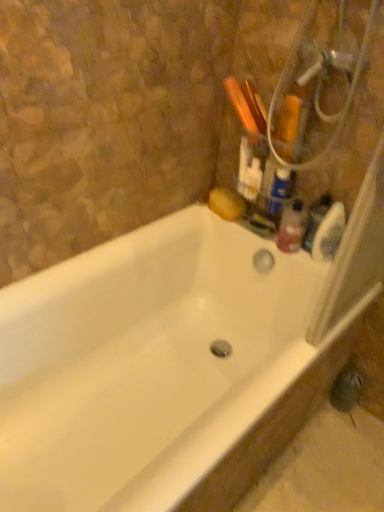
Where is `white glossy bathtub at upper right`? The height and width of the screenshot is (512, 384). white glossy bathtub at upper right is located at coordinates (147, 362).

What is the approximate height of translucent plastic bottle at upper right, marked as the second cleaning product in a bottom-to-top arrangement?

6.94 inches.

What are the coordinates of `metallic silver showerhead at upper right` in the screenshot? It's located at (346, 99).

Locate an element on the screen. white glossy bathtub at upper right is located at coordinates (147, 362).

From a real-world perspective, is translucent plastic soap dispenser at upper right beneath translucent plastic bottle at upper right, which ranks as the 1th cleaning product in top-to-bottom order?

Yes, from a real-world perspective, translucent plastic soap dispenser at upper right is below translucent plastic bottle at upper right, which ranks as the 1th cleaning product in top-to-bottom order.

Considering the relative positions of translucent plastic soap dispenser at upper right and translucent plastic bottle at upper right, marked as the second cleaning product in a bottom-to-top arrangement, in the image provided, is translucent plastic soap dispenser at upper right to the left of translucent plastic bottle at upper right, marked as the second cleaning product in a bottom-to-top arrangement, from the viewer's perspective?

Incorrect, translucent plastic soap dispenser at upper right is not on the left side of translucent plastic bottle at upper right, marked as the second cleaning product in a bottom-to-top arrangement.

Does translucent plastic soap dispenser at upper right come in front of translucent plastic bottle at upper right, marked as the second cleaning product in a bottom-to-top arrangement?

No.

In the image, there is a translucent plastic bottle at upper right, placed as the 1th cleaning product when sorted from bottom to top. In order to click on bathtub below it (from a real-world perspective) in this screenshot , I will do `click(147, 362)`.

Which object is thinner, translucent plastic bottle at upper right, placed as the 1th cleaning product when sorted from bottom to top, or white glossy bathtub at upper right?

translucent plastic bottle at upper right, placed as the 1th cleaning product when sorted from bottom to top, is thinner.

From their relative heights in the image, would you say translucent plastic bottle at upper right, the second cleaning product in the top-to-bottom sequence, is taller or shorter than white glossy bathtub at upper right?

In the image, translucent plastic bottle at upper right, the second cleaning product in the top-to-bottom sequence, appears to be shorter than white glossy bathtub at upper right.

Is translucent plastic bottle at upper right, the second cleaning product in the top-to-bottom sequence, looking in the opposite direction of white glossy bathtub at upper right?

No, white glossy bathtub at upper right is not at the back of translucent plastic bottle at upper right, the second cleaning product in the top-to-bottom sequence.

Does white glossy bathtub at upper right lie in front of translucent plastic soap dispenser at upper right?

That is True.

Are white glossy bathtub at upper right and translucent plastic soap dispenser at upper right located far from each other?

white glossy bathtub at upper right is actually quite close to translucent plastic soap dispenser at upper right.

Which of these two, white glossy bathtub at upper right or translucent plastic soap dispenser at upper right, is thinner?

translucent plastic soap dispenser at upper right.

Is point (62, 421) closer or farther from the camera than point (324, 211)?

Point (62, 421).

Is there a large distance between translucent plastic soap dispenser at upper right and translucent plastic bottle at upper right, placed as the 1th cleaning product when sorted from bottom to top?

translucent plastic soap dispenser at upper right is near translucent plastic bottle at upper right, placed as the 1th cleaning product when sorted from bottom to top, not far away.

Is translucent plastic soap dispenser at upper right in front of translucent plastic bottle at upper right, placed as the 1th cleaning product when sorted from bottom to top?

Yes, the depth of translucent plastic soap dispenser at upper right is less than that of translucent plastic bottle at upper right, placed as the 1th cleaning product when sorted from bottom to top.

Based on their positions, is translucent plastic soap dispenser at upper right located to the left or right of translucent plastic bottle at upper right, placed as the 1th cleaning product when sorted from bottom to top?

Based on their positions, translucent plastic soap dispenser at upper right is located to the right of translucent plastic bottle at upper right, placed as the 1th cleaning product when sorted from bottom to top.

Find the location of a particular element. the 1st cleaning product counting from the left side of the translucent plastic soap dispenser at upper right is located at coordinates (292, 226).

Based on the photo, from their relative heights in the image, would you say white glossy bathtub at upper right is taller or shorter than translucent plastic bottle at upper right, marked as the second cleaning product in a bottom-to-top arrangement?

Considering their sizes, white glossy bathtub at upper right has more height than translucent plastic bottle at upper right, marked as the second cleaning product in a bottom-to-top arrangement.

Considering the sizes of objects white glossy bathtub at upper right and translucent plastic bottle at upper right, marked as the second cleaning product in a bottom-to-top arrangement, in the image provided, who is thinner, white glossy bathtub at upper right or translucent plastic bottle at upper right, marked as the second cleaning product in a bottom-to-top arrangement,?

translucent plastic bottle at upper right, marked as the second cleaning product in a bottom-to-top arrangement, is thinner.

Is point (309, 319) positioned before point (273, 199)?

Yes, point (309, 319) is in front of point (273, 199).

Identify the location of the 1st cleaning product behind when counting from the white glossy bathtub at upper right. Image resolution: width=384 pixels, height=512 pixels. (280, 190).

Can you see translucent plastic bottle at upper right, the second cleaning product in the top-to-bottom sequence, touching metallic silver showerhead at upper right?

There is a gap between translucent plastic bottle at upper right, the second cleaning product in the top-to-bottom sequence, and metallic silver showerhead at upper right.

Is metallic silver showerhead at upper right a part of translucent plastic bottle at upper right, placed as the 1th cleaning product when sorted from bottom to top?

No, metallic silver showerhead at upper right is located outside of translucent plastic bottle at upper right, placed as the 1th cleaning product when sorted from bottom to top.

Which of these two, translucent plastic bottle at upper right, placed as the 1th cleaning product when sorted from bottom to top, or metallic silver showerhead at upper right, is wider?

With larger width is metallic silver showerhead at upper right.

Does translucent plastic bottle at upper right, placed as the 1th cleaning product when sorted from bottom to top, turn towards metallic silver showerhead at upper right?

No, translucent plastic bottle at upper right, placed as the 1th cleaning product when sorted from bottom to top, is not turned towards metallic silver showerhead at upper right.

Is metallic silver showerhead at upper right smaller than translucent plastic bottle at upper right, placed as the 1th cleaning product when sorted from bottom to top?

No.

Which of these two, metallic silver showerhead at upper right or translucent plastic bottle at upper right, the second cleaning product in the top-to-bottom sequence, is wider?

metallic silver showerhead at upper right is wider.

From a real-world perspective, between metallic silver showerhead at upper right and translucent plastic bottle at upper right, the second cleaning product in the top-to-bottom sequence, who is vertically higher?

metallic silver showerhead at upper right, from a real-world perspective.

Which point is more forward, (300, 170) or (280, 233)?

Point (300, 170)

The image size is (384, 512). In order to click on toiletry on the right of translucent plastic bottle at upper right, which ranks as the 1th cleaning product in top-to-bottom order in this screenshot , I will do point(316,219).

The width and height of the screenshot is (384, 512). What are the coordinates of `bathtub below the translucent plastic bottle at upper right, the second cleaning product in the top-to-bottom sequence (from a real-world perspective)` in the screenshot? It's located at (147, 362).

From the image, which object appears to be nearer to white glossy bathtub at upper right, translucent plastic bottle at upper right, marked as the second cleaning product in a bottom-to-top arrangement, or translucent plastic bottle at upper right, placed as the 1th cleaning product when sorted from bottom to top?

translucent plastic bottle at upper right, placed as the 1th cleaning product when sorted from bottom to top, is closer to white glossy bathtub at upper right.

Which object lies nearer to the anchor point translucent plastic soap dispenser at upper right, translucent plastic bottle at upper right, marked as the second cleaning product in a bottom-to-top arrangement, or white glossy bathtub at upper right?

Among the two, translucent plastic bottle at upper right, marked as the second cleaning product in a bottom-to-top arrangement, is located nearer to translucent plastic soap dispenser at upper right.

Based on their spatial positions, is translucent plastic bottle at upper right, marked as the second cleaning product in a bottom-to-top arrangement, or metallic silver showerhead at upper right further from translucent plastic bottle at upper right, the second cleaning product in the top-to-bottom sequence?

The object further to translucent plastic bottle at upper right, the second cleaning product in the top-to-bottom sequence, is metallic silver showerhead at upper right.

Which object lies nearer to the anchor point white glossy bathtub at upper right, translucent plastic soap dispenser at upper right or translucent plastic bottle at upper right, which ranks as the 1th cleaning product in top-to-bottom order?

Among the two, translucent plastic bottle at upper right, which ranks as the 1th cleaning product in top-to-bottom order, is located nearer to white glossy bathtub at upper right.

Consider the image. Which object lies further to the anchor point translucent plastic bottle at upper right, the second cleaning product in the top-to-bottom sequence, white glossy bathtub at upper right or metallic silver showerhead at upper right?

Based on the image, white glossy bathtub at upper right appears to be further to translucent plastic bottle at upper right, the second cleaning product in the top-to-bottom sequence.

Consider the image. Considering their positions, is translucent plastic soap dispenser at upper right positioned further to translucent plastic bottle at upper right, placed as the 1th cleaning product when sorted from bottom to top, than metallic silver showerhead at upper right?

metallic silver showerhead at upper right is further to translucent plastic bottle at upper right, placed as the 1th cleaning product when sorted from bottom to top.

From the image, which object appears to be farther from translucent plastic bottle at upper right, the second cleaning product in the top-to-bottom sequence, translucent plastic soap dispenser at upper right or white glossy bathtub at upper right?

Among the two, white glossy bathtub at upper right is located further to translucent plastic bottle at upper right, the second cleaning product in the top-to-bottom sequence.

From the image, which object appears to be nearer to translucent plastic soap dispenser at upper right, translucent plastic bottle at upper right, the second cleaning product in the top-to-bottom sequence, or translucent plastic bottle at upper right, which ranks as the 1th cleaning product in top-to-bottom order?

translucent plastic bottle at upper right, the second cleaning product in the top-to-bottom sequence.

The height and width of the screenshot is (512, 384). In order to click on bathtub between metallic silver showerhead at upper right and translucent plastic bottle at upper right, marked as the second cleaning product in a bottom-to-top arrangement, from front to back in this screenshot , I will do `click(147, 362)`.

Where is `toiletry between white glossy bathtub at upper right and translucent plastic bottle at upper right, the second cleaning product in the top-to-bottom sequence, along the z-axis`? The height and width of the screenshot is (512, 384). toiletry between white glossy bathtub at upper right and translucent plastic bottle at upper right, the second cleaning product in the top-to-bottom sequence, along the z-axis is located at coordinates (316, 219).

Locate an element on the screen. The image size is (384, 512). cleaning product between metallic silver showerhead at upper right and translucent plastic bottle at upper right, the second cleaning product in the top-to-bottom sequence, from front to back is located at coordinates (280, 190).

This screenshot has width=384, height=512. I want to click on cleaning product positioned between white glossy bathtub at upper right and translucent plastic bottle at upper right, the second cleaning product in the top-to-bottom sequence, from near to far, so click(280, 190).